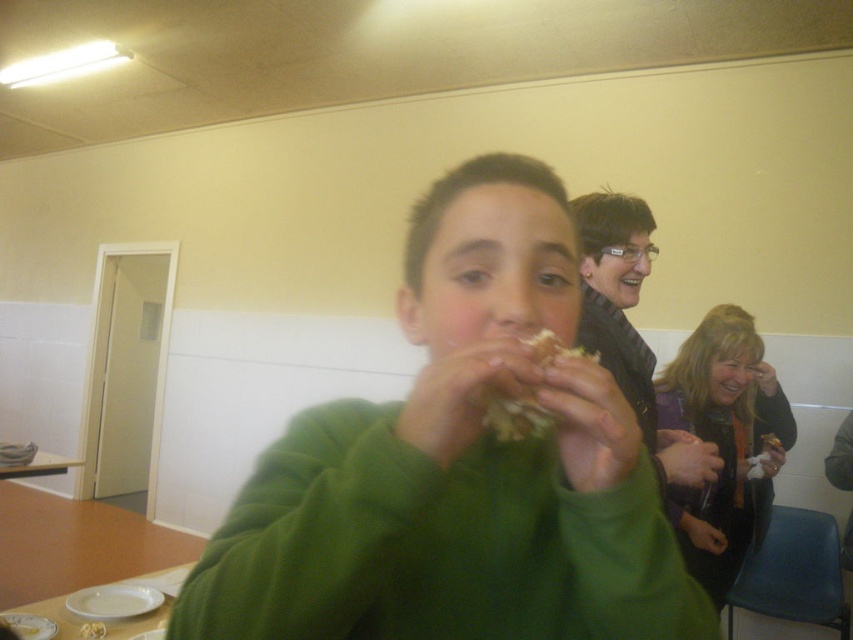
Who is positioned more to the left, white glossy plate at lower left or wooden table at lower left?

wooden table at lower left is more to the left.

Can you confirm if white glossy plate at lower left is smaller than wooden table at lower left?

Yes.

Between point (73, 621) and point (35, 456), which one is positioned behind?

The point (35, 456) is more distant.

This screenshot has width=853, height=640. Find the location of `white glossy plate at lower left`. white glossy plate at lower left is located at coordinates (152, 611).

Is green matte sweater at center taller than matte black jacket at upper right?

No, green matte sweater at center is not taller than matte black jacket at upper right.

Who is more forward, [364,572] or [633,234]?

Point [364,572] is in front.

At what (x,y) coordinates should I click in order to perform the action: click on green matte sweater at center. Please return your answer as a coordinate pair (x, y). Looking at the image, I should click on (457, 465).

Is matte black jacket at upper right to the left of wooden table at lower left from the viewer's perspective?

Incorrect, matte black jacket at upper right is not on the left side of wooden table at lower left.

Can you confirm if matte black jacket at upper right is shorter than wooden table at lower left?

In fact, matte black jacket at upper right may be taller than wooden table at lower left.

Find the location of a particular element. The image size is (853, 640). matte black jacket at upper right is located at coordinates pyautogui.click(x=630, y=326).

You are a GUI agent. You are given a task and a screenshot of the screen. Output one action in this format:
    pyautogui.click(x=<x>, y=<y>)
    Task: Click on the matte black jacket at upper right
    
    Given the screenshot: What is the action you would take?
    pyautogui.click(x=630, y=326)